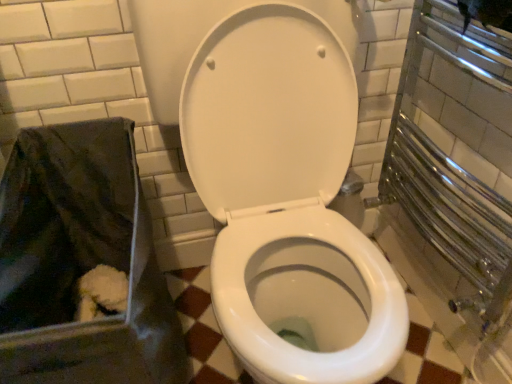
In order to face white glossy toilet at center, should I rotate leftwards or rightwards?

To face it directly, rotate right by 3.809 degrees.

Describe the element at coordinates (287, 199) in the screenshot. I see `white glossy toilet at center` at that location.

Where is `white glossy toilet at center`? white glossy toilet at center is located at coordinates (287, 199).

Describe the element at coordinates (81, 262) in the screenshot. The image size is (512, 384). I see `black fabric bag at lower left` at that location.

The height and width of the screenshot is (384, 512). Find the location of `black fabric bag at lower left`. black fabric bag at lower left is located at coordinates (81, 262).

Identify the location of white glossy toilet at center. (287, 199).

From the picture: Which object is positioned more to the right, black fabric bag at lower left or white glossy toilet at center?

white glossy toilet at center is more to the right.

From the picture: Which is in front, black fabric bag at lower left or white glossy toilet at center?

white glossy toilet at center.

Does point (75, 210) come in front of point (262, 164)?

No, (75, 210) is behind (262, 164).

From the image's perspective, which object appears higher, black fabric bag at lower left or white glossy toilet at center?

white glossy toilet at center, from the image's perspective.

From a real-world perspective, which object rests below the other?

black fabric bag at lower left.

Considering the relative sizes of black fabric bag at lower left and white glossy toilet at center in the image provided, is black fabric bag at lower left wider than white glossy toilet at center?

No, black fabric bag at lower left is not wider than white glossy toilet at center.

Can you confirm if black fabric bag at lower left is shorter than white glossy toilet at center?

Yes, black fabric bag at lower left is shorter than white glossy toilet at center.

Considering the sizes of objects black fabric bag at lower left and white glossy toilet at center in the image provided, who is bigger, black fabric bag at lower left or white glossy toilet at center?

Bigger between the two is white glossy toilet at center.

Could white glossy toilet at center be considered to be inside black fabric bag at lower left?

No, white glossy toilet at center is not a part of black fabric bag at lower left.

Is black fabric bag at lower left not near white glossy toilet at center?

Actually, black fabric bag at lower left and white glossy toilet at center are a little close together.

Is black fabric bag at lower left oriented towards white glossy toilet at center?

No, black fabric bag at lower left is not aimed at white glossy toilet at center.

Consider the image. Can you tell me how much black fabric bag at lower left and white glossy toilet at center differ in facing direction?

The angular difference between black fabric bag at lower left and white glossy toilet at center is 0.000246 degrees.

Where is `toilet lying above the black fabric bag at lower left (from the image's perspective)`? The width and height of the screenshot is (512, 384). toilet lying above the black fabric bag at lower left (from the image's perspective) is located at coordinates (287, 199).

From the picture: Considering the relative positions of white glossy toilet at center and black fabric bag at lower left in the image provided, is white glossy toilet at center to the right of black fabric bag at lower left from the viewer's perspective?

Yes, white glossy toilet at center is to the right of black fabric bag at lower left.

Is white glossy toilet at center in front of or behind black fabric bag at lower left in the image?

white glossy toilet at center is in front of black fabric bag at lower left.

Is point (236, 104) positioned after point (38, 211)?

No, it is not.

From the image's perspective, relative to black fabric bag at lower left, is white glossy toilet at center above or below?

Clearly, from the image's perspective, white glossy toilet at center is above black fabric bag at lower left.

Based on the photo, from a real-world perspective, who is located higher, white glossy toilet at center or black fabric bag at lower left?

white glossy toilet at center is physically above.

Can you confirm if white glossy toilet at center is wider than black fabric bag at lower left?

Yes, white glossy toilet at center is wider than black fabric bag at lower left.

Based on the photo, between white glossy toilet at center and black fabric bag at lower left, which one has more height?

white glossy toilet at center.

Looking at this image, considering the sizes of objects white glossy toilet at center and black fabric bag at lower left in the image provided, who is bigger, white glossy toilet at center or black fabric bag at lower left?

With larger size is white glossy toilet at center.

Is black fabric bag at lower left inside white glossy toilet at center?

That's incorrect, black fabric bag at lower left is not inside white glossy toilet at center.

Is the surface of white glossy toilet at center in direct contact with black fabric bag at lower left?

No, white glossy toilet at center is not in contact with black fabric bag at lower left.

Could you tell me if white glossy toilet at center is facing black fabric bag at lower left?

No.

How many degrees apart are the facing directions of white glossy toilet at center and black fabric bag at lower left?

There is a 0.000246-degree angle between the facing directions of white glossy toilet at center and black fabric bag at lower left.

Locate an element on the screen. The image size is (512, 384). toilet to the right of black fabric bag at lower left is located at coordinates (x=287, y=199).

You are a GUI agent. You are given a task and a screenshot of the screen. Output one action in this format:
    pyautogui.click(x=<x>, y=<y>)
    Task: Click on the toilet located above the black fabric bag at lower left (from the image's perspective)
    
    Given the screenshot: What is the action you would take?
    pyautogui.click(x=287, y=199)

Identify the location of toilet on the right of black fabric bag at lower left. (287, 199).